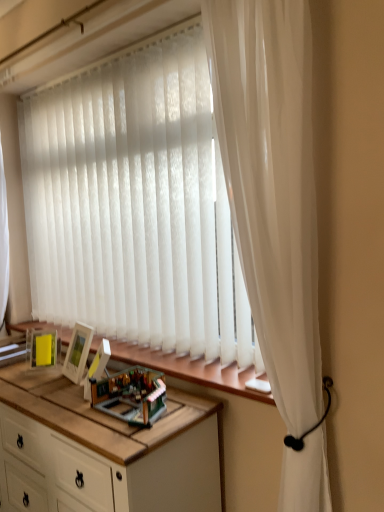
Measure the distance between wooden at lower center and camera.

A distance of 4.51 feet exists between wooden at lower center and camera.

What are the coordinates of `translucent plastic toy at center` in the screenshot? It's located at (131, 395).

Where is `white wood cabinet at center`? This screenshot has height=512, width=384. white wood cabinet at center is located at coordinates (105, 471).

Image resolution: width=384 pixels, height=512 pixels. Find the location of `wooden at lower center`. wooden at lower center is located at coordinates (191, 370).

Does white wood cabinet at center turn towards wooden at lower center?

No, white wood cabinet at center is not facing towards wooden at lower center.

Consider the image. How different are the orientations of white wood cabinet at center and wooden at lower center in degrees?

white wood cabinet at center and wooden at lower center are facing 0.342 degrees away from each other.

Is white wood cabinet at center shorter than wooden at lower center?

Incorrect, the height of white wood cabinet at center does not fall short of that of wooden at lower center.

Measure the distance between translucent plastic toy at center and white wood cabinet at center.

They are 9.63 inches apart.

Looking at this image, can we say translucent plastic toy at center lies outside white wood cabinet at center?

That's correct, translucent plastic toy at center is outside of white wood cabinet at center.

Can you confirm if translucent plastic toy at center is bigger than white wood cabinet at center?

No.

Which object is wider, translucent plastic toy at center or white sheer curtain at right?

With larger width is white sheer curtain at right.

Does translucent plastic toy at center touch white sheer curtain at right?

There is a gap between translucent plastic toy at center and white sheer curtain at right.

Consider the image. Could you tell me if translucent plastic toy at center is facing white sheer curtain at right?

No, translucent plastic toy at center is not oriented towards white sheer curtain at right.

Can we say translucent plastic toy at center lies outside white sheer curtain at right?

Yes, translucent plastic toy at center is located beyond the bounds of white sheer curtain at right.

The width and height of the screenshot is (384, 512). Identify the location of curtain that is above the translucent plastic toy at center (from the image's perspective). (272, 184).

Is white sheer curtain at right directly adjacent to translucent plastic toy at center?

No, white sheer curtain at right is not in contact with translucent plastic toy at center.

Which is in front, point (233, 214) or point (137, 377)?

Positioned in front is point (233, 214).

How different are the orientations of white sheer curtain at right and translucent plastic toy at center in degrees?

The facing directions of white sheer curtain at right and translucent plastic toy at center are 1.29 degrees apart.

Is wooden at lower center at the right side of white wood cabinet at center?

Yes, wooden at lower center is to the right of white wood cabinet at center.

What's the angular difference between wooden at lower center and white wood cabinet at center's facing directions?

There is a 0.342-degree angle between the facing directions of wooden at lower center and white wood cabinet at center.

From the image's perspective, is wooden at lower center located above or below white wood cabinet at center?

wooden at lower center is above white wood cabinet at center.

Considering the relative sizes of wooden at lower center and white wood cabinet at center in the image provided, is wooden at lower center shorter than white wood cabinet at center?

Correct, wooden at lower center is not as tall as white wood cabinet at center.

Between wooden at lower center and translucent plastic toy at center, which one appears on the left side from the viewer's perspective?

Positioned to the left is wooden at lower center.

Is the depth of wooden at lower center less than that of translucent plastic toy at center?

No, it is not.

What's the angular difference between wooden at lower center and translucent plastic toy at center's facing directions?

They differ by 2.72 degrees in their facing directions.

Looking at the image, does wooden at lower center seem bigger or smaller compared to translucent plastic toy at center?

wooden at lower center is bigger than translucent plastic toy at center.

Is white sheer curtain at right positioned in front of white wood cabinet at center?

Yes, white sheer curtain at right is closer to the viewer.

Does white sheer curtain at right have a greater height compared to white wood cabinet at center?

Yes.

From the image's perspective, which is below, white sheer curtain at right or white wood cabinet at center?

white wood cabinet at center appears lower in the image.

Identify the location of window sill positioned vertically above the white wood cabinet at center (from a real-world perspective). The height and width of the screenshot is (512, 384). (191, 370).

At what (x,y) coordinates should I click in order to perform the action: click on toy above the white wood cabinet at center (from the image's perspective). Please return your answer as a coordinate pair (x, y). The width and height of the screenshot is (384, 512). Looking at the image, I should click on (131, 395).

Estimate the real-world distances between objects in this image. Which object is further from translucent plastic toy at center, white sheer curtain at right or white wood cabinet at center?

white sheer curtain at right is positioned further to the anchor translucent plastic toy at center.

When comparing their distances from translucent plastic toy at center, does white wood cabinet at center or white sheer curtain at right seem further?

white sheer curtain at right is positioned further to the anchor translucent plastic toy at center.

Looking at the image, which one is located further to translucent plastic toy at center, white wood cabinet at center or wooden at lower center?

Based on the image, white wood cabinet at center appears to be further to translucent plastic toy at center.

Looking at the image, which one is located closer to white wood cabinet at center, white sheer curtain at right or wooden at lower center?

The object closer to white wood cabinet at center is wooden at lower center.

Looking at the image, which one is located further to white sheer curtain at right, wooden at lower center or translucent plastic toy at center?

translucent plastic toy at center.

When comparing their distances from wooden at lower center, does white wood cabinet at center or white sheer curtain at right seem closer?

Based on the image, white wood cabinet at center appears to be nearer to wooden at lower center.

From the image, which object appears to be nearer to white sheer curtain at right, white wood cabinet at center or wooden at lower center?

wooden at lower center is closer to white sheer curtain at right.

Based on their spatial positions, is translucent plastic toy at center or white wood cabinet at center closer to white sheer curtain at right?

translucent plastic toy at center is closer to white sheer curtain at right.

You are a GUI agent. You are given a task and a screenshot of the screen. Output one action in this format:
    pyautogui.click(x=<x>, y=<y>)
    Task: Click on the window sill between white sheer curtain at right and white wood cabinet at center in the up-down direction
    Image resolution: width=384 pixels, height=512 pixels.
    Given the screenshot: What is the action you would take?
    pyautogui.click(x=191, y=370)

Where is `toy between wooden at lower center and white wood cabinet at center in the up-down direction`? The image size is (384, 512). toy between wooden at lower center and white wood cabinet at center in the up-down direction is located at coordinates (131, 395).

Where is `toy that lies between white sheer curtain at right and white wood cabinet at center from top to bottom`? Image resolution: width=384 pixels, height=512 pixels. toy that lies between white sheer curtain at right and white wood cabinet at center from top to bottom is located at coordinates (131, 395).

Locate an element on the screen. The width and height of the screenshot is (384, 512). toy between wooden at lower center and white sheer curtain at right from left to right is located at coordinates (131, 395).